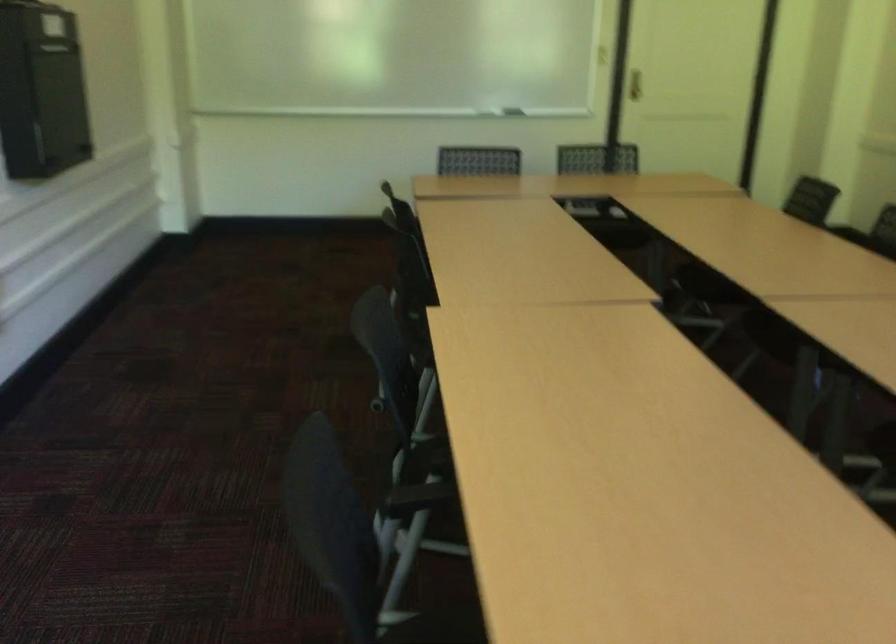
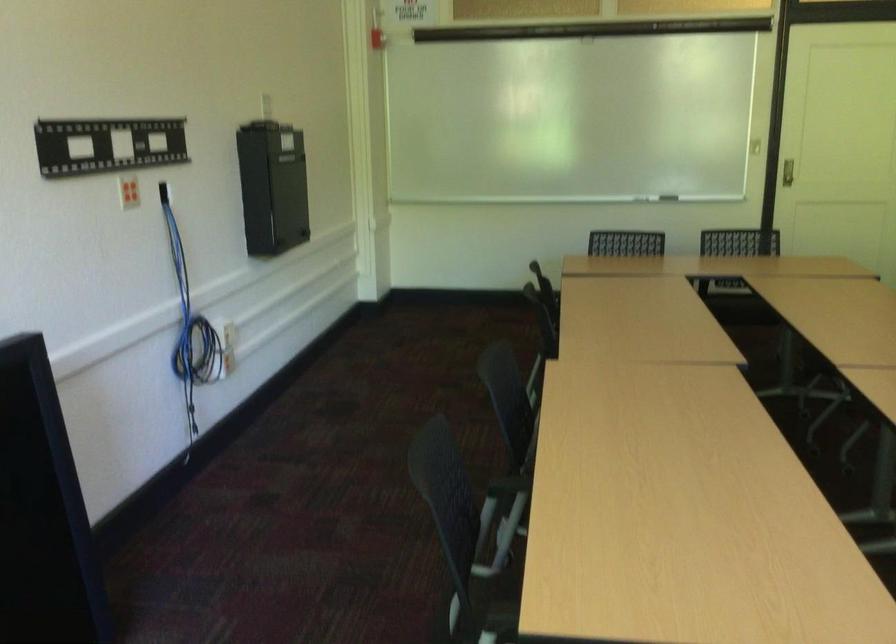
Which direction would the cameraman need to move to produce the second image?

The cameraman walked toward right, backward.